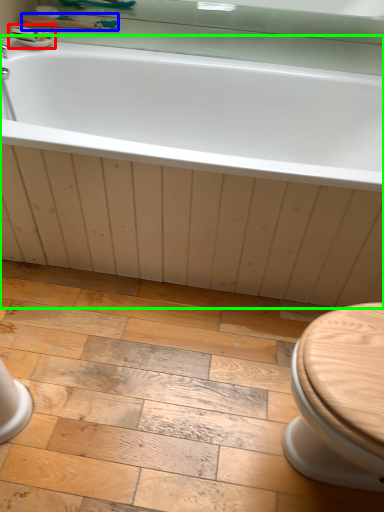
Question: Which object is positioned farthest from sink (highlighted by a red box)? Select from shower (highlighted by a blue box) and bathtub (highlighted by a green box).

Choices:
 (A) shower
 (B) bathtub

Answer: (B)